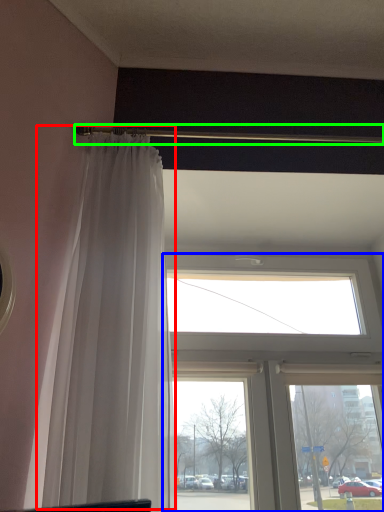
Question: Estimate the real-world distances between objects in this image. Which object is farther from curtain (highlighted by a red box), window (highlighted by a blue box) or beam (highlighted by a green box)?

Choices:
 (A) window
 (B) beam

Answer: (A)